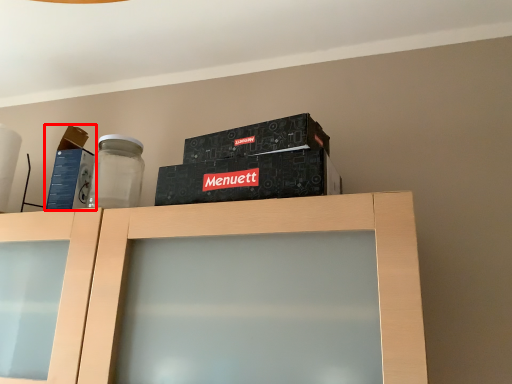
Question: From the image's perspective, where is box (annotated by the red box) located relative to cabinetry?

Choices:
 (A) below
 (B) above

Answer: (B)